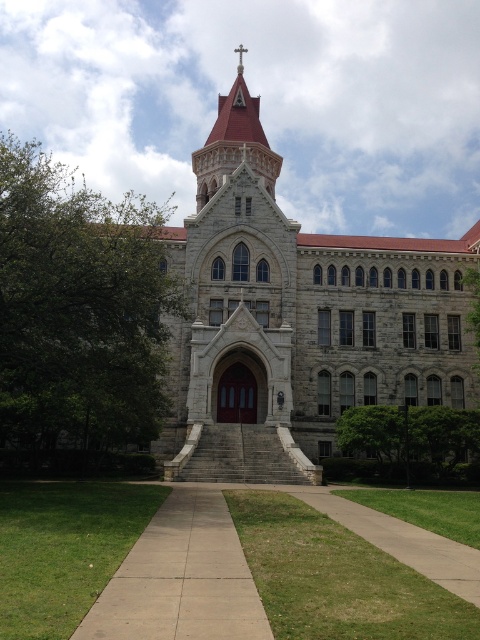
Question: Which point appears farthest from the camera in this image?

Choices:
 (A) (276, 326)
 (B) (203, 196)

Answer: (B)

Question: Which point appears closest to the camera in this image?

Choices:
 (A) (396, 294)
 (B) (205, 186)

Answer: (A)

Question: Is gray stone church at center to the left of reddish-brown stone spire at center from the viewer's perspective?

Choices:
 (A) yes
 (B) no

Answer: (B)

Question: Can you confirm if gray stone church at center is smaller than reddish-brown stone spire at center?

Choices:
 (A) no
 (B) yes

Answer: (A)

Question: Can you confirm if gray stone church at center is positioned above reddish-brown stone spire at center?

Choices:
 (A) no
 (B) yes

Answer: (A)